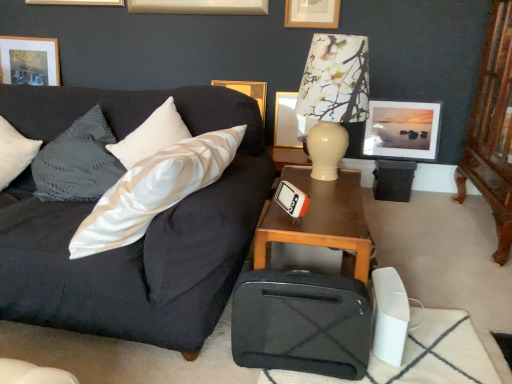
The image size is (512, 384). I want to click on empty space that is ontop of gold metallic picture frame at upper center, positioned as the 4th picture frame in right-to-left order (from a real-world perspective), so click(x=238, y=78).